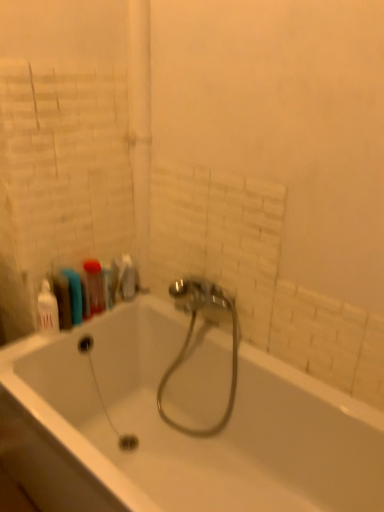
Question: Are shiny chrome faucet at center and white glossy bottle at left, acting as the first toiletry starting from the front, beside each other?

Choices:
 (A) no
 (B) yes

Answer: (A)

Question: Is shiny chrome faucet at center surrounding white glossy bottle at left, the first toiletry in the left-to-right sequence?

Choices:
 (A) yes
 (B) no

Answer: (B)

Question: Does shiny chrome faucet at center have a lesser width compared to white glossy bottle at left, the 2th toiletry from the back?

Choices:
 (A) no
 (B) yes

Answer: (A)

Question: Does shiny chrome faucet at center have a greater height compared to white glossy bottle at left, the first toiletry in the left-to-right sequence?

Choices:
 (A) no
 (B) yes

Answer: (B)

Question: Is shiny chrome faucet at center wider than white glossy bottle at left, the second toiletry from the right?

Choices:
 (A) yes
 (B) no

Answer: (A)

Question: Is point (57, 317) positioned closer to the camera than point (89, 311)?

Choices:
 (A) closer
 (B) farther

Answer: (A)

Question: Relative to translucent plastic bottle at left, is white glossy bottle at left, the second toiletry from the right, in front or behind?

Choices:
 (A) behind
 (B) front

Answer: (B)

Question: Considering the positions of white glossy bottle at left, the first toiletry in the left-to-right sequence, and translucent plastic bottle at left in the image, is white glossy bottle at left, the first toiletry in the left-to-right sequence, taller or shorter than translucent plastic bottle at left?

Choices:
 (A) tall
 (B) short

Answer: (A)

Question: From the image's perspective, is white glossy bottle at left, the first toiletry in the left-to-right sequence, positioned above or below translucent plastic bottle at left?

Choices:
 (A) below
 (B) above

Answer: (A)

Question: Is translucent plastic bottle at left taller or shorter than white glossy bottle at left, the 2th toiletry from the back?

Choices:
 (A) short
 (B) tall

Answer: (A)

Question: Is translucent plastic bottle at left inside the boundaries of white glossy bottle at left, the 2th toiletry from the back, or outside?

Choices:
 (A) outside
 (B) inside

Answer: (A)

Question: From a real-world perspective, relative to white glossy bottle at left, the 2th toiletry from the back, is translucent plastic bottle at left vertically above or below?

Choices:
 (A) below
 (B) above

Answer: (B)

Question: Considering the positions of translucent plastic bottle at left and white glossy bottle at left, acting as the first toiletry starting from the front, in the image, is translucent plastic bottle at left wider or thinner than white glossy bottle at left, acting as the first toiletry starting from the front,?

Choices:
 (A) wide
 (B) thin

Answer: (A)

Question: Is shiny chrome faucet at center wider or thinner than translucent plastic bottle at left?

Choices:
 (A) thin
 (B) wide

Answer: (B)

Question: Choose the correct answer: Is shiny chrome faucet at center inside translucent plastic bottle at left or outside it?

Choices:
 (A) outside
 (B) inside

Answer: (A)